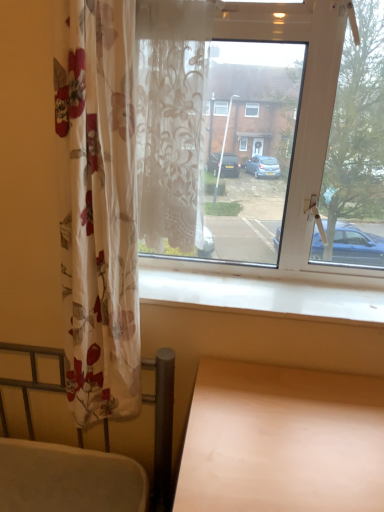
Describe the element at coordinates (258, 294) in the screenshot. I see `white smooth window sill at lower center` at that location.

The width and height of the screenshot is (384, 512). What do you see at coordinates (282, 440) in the screenshot?
I see `light wood table at lower right` at bounding box center [282, 440].

The width and height of the screenshot is (384, 512). I want to click on white smooth window sill at lower center, so pos(258,294).

Between light wood table at lower right and translucent floral curtain at center, which one has less height?

light wood table at lower right.

Which object is further away from the camera taking this photo, light wood table at lower right or translucent floral curtain at center?

translucent floral curtain at center.

Between light wood table at lower right and translucent floral curtain at center, which one has larger width?

light wood table at lower right is wider.

Consider the image. Is white smooth window sill at lower center outside of light wood table at lower right?

white smooth window sill at lower center lies outside light wood table at lower right's area.

Can you tell me how much white smooth window sill at lower center and light wood table at lower right differ in facing direction?

white smooth window sill at lower center and light wood table at lower right are facing 0.0897 degrees away from each other.

From the image's perspective, is white smooth window sill at lower center below light wood table at lower right?

Incorrect, from the image's perspective, white smooth window sill at lower center is higher than light wood table at lower right.

Is the depth of white smooth window sill at lower center less than that of light wood table at lower right?

That is False.

Considering the sizes of objects translucent floral curtain at center and light wood table at lower right in the image provided, who is taller, translucent floral curtain at center or light wood table at lower right?

With more height is translucent floral curtain at center.

Is translucent floral curtain at center to the left of light wood table at lower right from the viewer's perspective?

Correct, you'll find translucent floral curtain at center to the left of light wood table at lower right.

Is point (193, 3) behind point (178, 498)?

Yes, it is behind point (178, 498).

Is translucent floral curtain at center directly adjacent to light wood table at lower right?

No, translucent floral curtain at center is not making contact with light wood table at lower right.

Considering the relative sizes of translucent floral curtain at center and transparent glass window at center in the image provided, is translucent floral curtain at center wider than transparent glass window at center?

Correct, the width of translucent floral curtain at center exceeds that of transparent glass window at center.

Who is taller, translucent floral curtain at center or transparent glass window at center?

With more height is transparent glass window at center.

From the image's perspective, would you say translucent floral curtain at center is positioned over transparent glass window at center?

Indeed, from the image's perspective, translucent floral curtain at center is shown above transparent glass window at center.

Is the position of translucent floral curtain at center less distant than that of transparent glass window at center?

Yes, it is in front of transparent glass window at center.

Considering the positions of objects light wood table at lower right and white smooth window sill at lower center in the image provided, who is more to the left, light wood table at lower right or white smooth window sill at lower center?

From the viewer's perspective, white smooth window sill at lower center appears more on the left side.

Is light wood table at lower right aimed at white smooth window sill at lower center?

No, light wood table at lower right is not oriented towards white smooth window sill at lower center.

Is light wood table at lower right not inside white smooth window sill at lower center?

Yes.

Does point (314, 500) appear closer or farther from the camera than point (264, 273)?

Point (314, 500) is closer to the camera than point (264, 273).

Is light wood table at lower right turned away from transparent glass window at center?

light wood table at lower right does not have its back to transparent glass window at center.

From the image's perspective, relative to transparent glass window at center, is light wood table at lower right above or below?

From the image's perspective, light wood table at lower right appears below transparent glass window at center.

In the scene shown: Which of these two, white smooth window sill at lower center or translucent floral curtain at center, is bigger?

translucent floral curtain at center is bigger.

Between white smooth window sill at lower center and translucent floral curtain at center, which one has larger width?

white smooth window sill at lower center is wider.

Does white smooth window sill at lower center turn towards translucent floral curtain at center?

No, white smooth window sill at lower center is not oriented towards translucent floral curtain at center.

Is white smooth window sill at lower center in front of or behind translucent floral curtain at center in the image?

white smooth window sill at lower center is behind translucent floral curtain at center.

Find the location of a particular element. curtain above the light wood table at lower right (from a real-world perspective) is located at coordinates (171, 121).

Find the location of `window sill that is on the left side of light wood table at lower right`. window sill that is on the left side of light wood table at lower right is located at coordinates (258, 294).

Estimate the real-world distances between objects in this image. Which object is further from white smooth window sill at lower center, translucent floral curtain at center or transparent glass window at center?

translucent floral curtain at center lies further to white smooth window sill at lower center than the other object.

Looking at the image, which one is located further to translucent floral curtain at center, light wood table at lower right or white smooth window sill at lower center?

light wood table at lower right is further to translucent floral curtain at center.

Looking at the image, which one is located further to white smooth window sill at lower center, transparent glass window at center or light wood table at lower right?

The object further to white smooth window sill at lower center is light wood table at lower right.

When comparing their distances from transparent glass window at center, does light wood table at lower right or translucent floral curtain at center seem closer?

Among the two, translucent floral curtain at center is located nearer to transparent glass window at center.

Considering their positions, is transparent glass window at center positioned further to light wood table at lower right than white smooth window sill at lower center?

transparent glass window at center.

Considering their positions, is transparent glass window at center positioned closer to translucent floral curtain at center than light wood table at lower right?

The object closer to translucent floral curtain at center is transparent glass window at center.

Estimate the real-world distances between objects in this image. Which object is further from translucent floral curtain at center, transparent glass window at center or white smooth window sill at lower center?

white smooth window sill at lower center lies further to translucent floral curtain at center than the other object.

Looking at the image, which one is located closer to light wood table at lower right, translucent floral curtain at center or transparent glass window at center?

transparent glass window at center.

Find the location of a particular element. This screenshot has width=384, height=512. window between translucent floral curtain at center and light wood table at lower right in the up-down direction is located at coordinates (297, 123).

This screenshot has width=384, height=512. I want to click on window sill between translucent floral curtain at center and light wood table at lower right vertically, so click(258, 294).

Identify the location of window between translucent floral curtain at center and white smooth window sill at lower center in the vertical direction. (297, 123).

You are a GUI agent. You are given a task and a screenshot of the screen. Output one action in this format:
    pyautogui.click(x=<x>, y=<y>)
    Task: Click on the window sill between transparent glass window at center and light wood table at lower right in the up-down direction
    This screenshot has width=384, height=512.
    Given the screenshot: What is the action you would take?
    pyautogui.click(x=258, y=294)